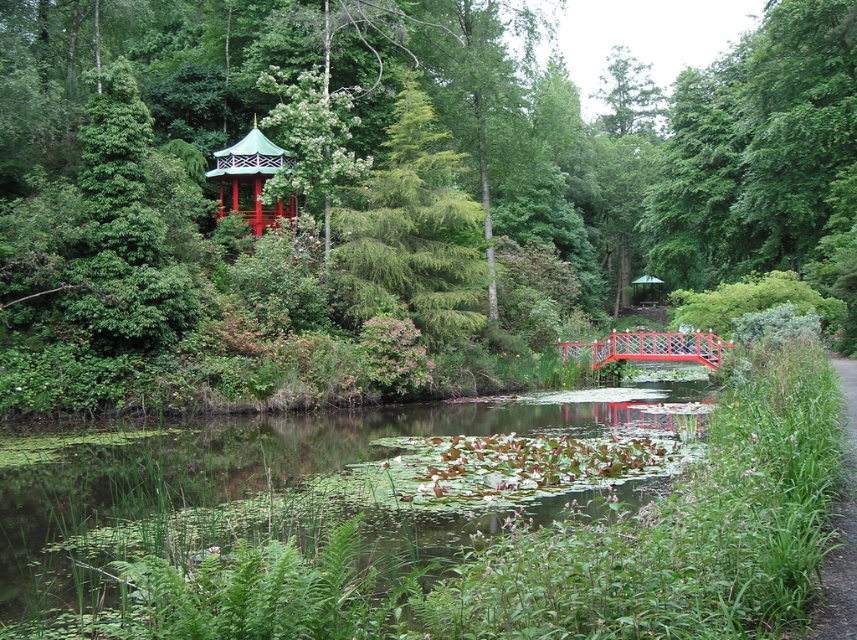
Who is positioned more to the right, green textured pine tree at center or green grass at right?

Positioned to the right is green grass at right.

Can you confirm if green textured pine tree at center is positioned to the right of green grass at right?

In fact, green textured pine tree at center is to the left of green grass at right.

Does point (440, 269) come behind point (830, 625)?

Yes, point (440, 269) is behind point (830, 625).

I want to click on green textured pine tree at center, so click(414, 230).

Measure the distance between green glossy pagoda at upper center and metallic red bridge at center.

green glossy pagoda at upper center and metallic red bridge at center are 29.32 meters apart from each other.

Can you confirm if green glossy pagoda at upper center is bigger than metallic red bridge at center?

Yes, green glossy pagoda at upper center is bigger than metallic red bridge at center.

This screenshot has height=640, width=857. What do you see at coordinates (387, 188) in the screenshot? I see `green glossy pagoda at upper center` at bounding box center [387, 188].

Identify the location of green glossy pagoda at upper center. (387, 188).

Is green glossy pagoda at upper center positioned before green leafy water at center?

No, it is behind green leafy water at center.

Who is shorter, green glossy pagoda at upper center or green leafy water at center?

Standing shorter between the two is green leafy water at center.

Which is behind, point (847, 179) or point (325, 504)?

Positioned behind is point (847, 179).

Identify the location of green glossy pagoda at upper center. Image resolution: width=857 pixels, height=640 pixels. (387, 188).